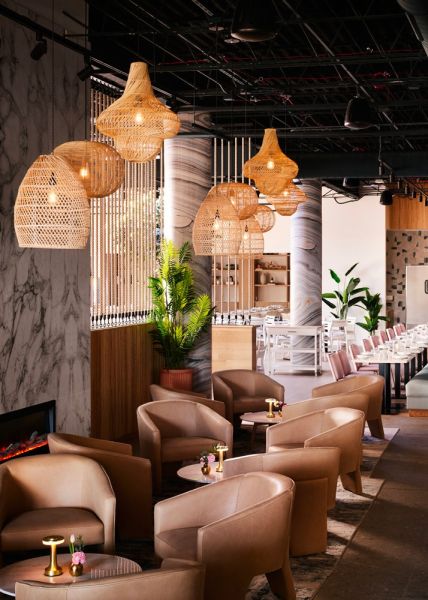
At what (x,y) coordinates should I click in order to perform the action: click on long table. Please return your answer as a coordinate pair (x, y). The width and height of the screenshot is (428, 600). Looking at the image, I should click on (374, 359).